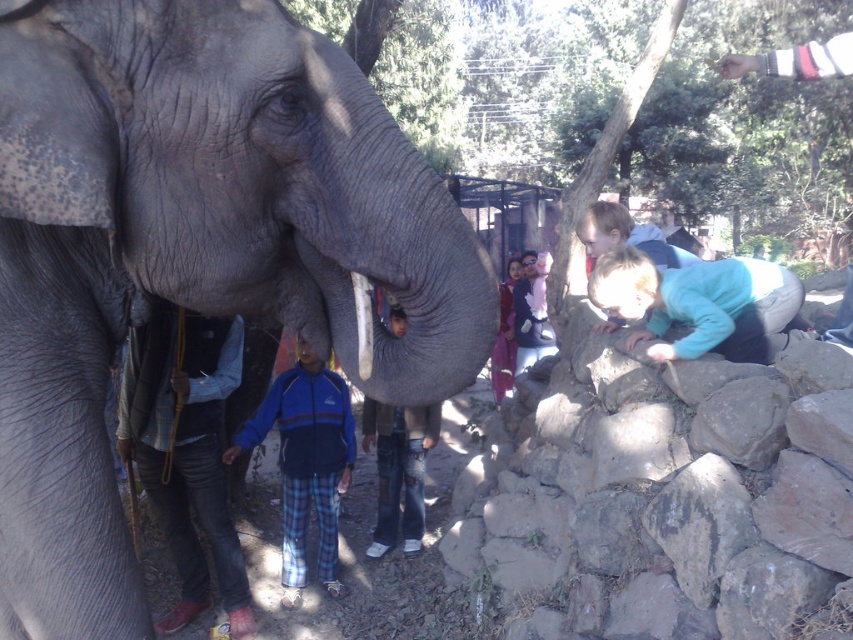
You are a photographer trying to capture a photo of the blue fleece jacket at center and the gray matte elephant at left. If you want to ensure both are fully visible in the frame, which object should you adjust your camera focus to prioritize based on their sizes?

The gray matte elephant at left is wider than the blue fleece jacket at center. Therefore, you should prioritize focusing on the gray matte elephant at left since it occupies more space in the frame, ensuring it remains clear while the smaller jacket should still be visible.

You are a photographer trying to capture a clear shot of the gray matte elephant at left. Based on its position coordinates, where should you aim your camera?

The gray matte elephant at left is positioned at coordinates point (189, 250), so you should aim your camera at that point to capture it clearly.

You are a photographer trying to capture a clear shot of both the blue fleece jacket at center and the blue fleece jacket at lower left. Based on their sizes in the image, which jacket should you focus on first to ensure it fits within your camera frame?

The blue fleece jacket at center is larger in size compared to the blue fleece jacket at lower left. To ensure both fit in the frame, focus on the larger jacket first, then adjust to include the smaller one.